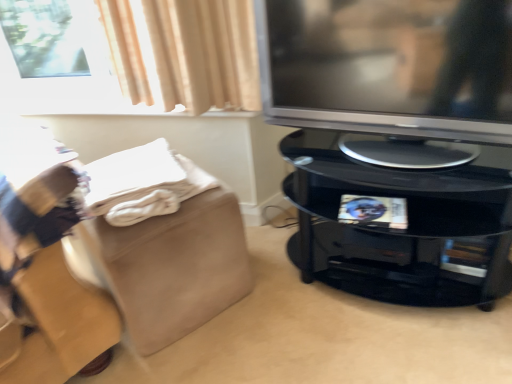
Question: From the image's perspective, is beige suede footrest at lower left located beneath white soft blanket at lower left?

Choices:
 (A) no
 (B) yes

Answer: (B)

Question: Can you confirm if beige suede footrest at lower left is positioned to the right of white soft blanket at lower left?

Choices:
 (A) yes
 (B) no

Answer: (A)

Question: Is beige suede footrest at lower left positioned before white soft blanket at lower left?

Choices:
 (A) yes
 (B) no

Answer: (B)

Question: Is beige suede footrest at lower left wider than white soft blanket at lower left?

Choices:
 (A) no
 (B) yes

Answer: (B)

Question: From the image's perspective, does beige suede footrest at lower left appear higher than white soft blanket at lower left?

Choices:
 (A) yes
 (B) no

Answer: (B)

Question: Considering their positions, is white soft blanket at lower left located in front of or behind satin silver television at right?

Choices:
 (A) behind
 (B) front

Answer: (A)

Question: Choose the correct answer: Is white soft blanket at lower left inside satin silver television at right or outside it?

Choices:
 (A) inside
 (B) outside

Answer: (B)

Question: Looking at their shapes, would you say white soft blanket at lower left is wider or thinner than satin silver television at right?

Choices:
 (A) wide
 (B) thin

Answer: (A)

Question: From the image's perspective, relative to satin silver television at right, is white soft blanket at lower left above or below?

Choices:
 (A) below
 (B) above

Answer: (A)

Question: Based on their positions, is beige suede footrest at lower left located to the left or right of glossy black tv stand at right?

Choices:
 (A) left
 (B) right

Answer: (A)

Question: From the image's perspective, is beige suede footrest at lower left above or below glossy black tv stand at right?

Choices:
 (A) above
 (B) below

Answer: (B)

Question: Choose the correct answer: Is beige suede footrest at lower left inside glossy black tv stand at right or outside it?

Choices:
 (A) outside
 (B) inside

Answer: (A)

Question: Considering the positions of point (140, 306) and point (458, 236), is point (140, 306) closer or farther from the camera than point (458, 236)?

Choices:
 (A) closer
 (B) farther

Answer: (B)

Question: Based on their positions, is satin silver television at right located to the left or right of beige suede footrest at lower left?

Choices:
 (A) right
 (B) left

Answer: (A)

Question: From a real-world perspective, relative to beige suede footrest at lower left, is satin silver television at right vertically above or below?

Choices:
 (A) above
 (B) below

Answer: (A)